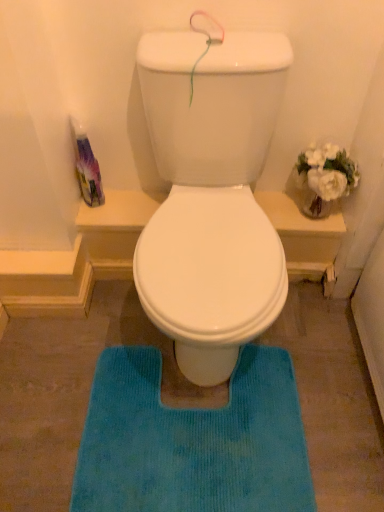
Image resolution: width=384 pixels, height=512 pixels. Find the location of `vacant area that is situated to the right of blue textured bath mat at center`. vacant area that is situated to the right of blue textured bath mat at center is located at coordinates (330, 395).